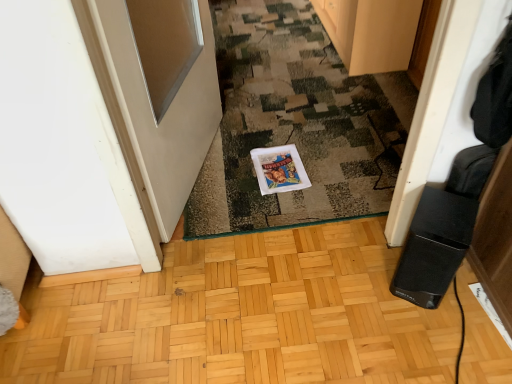
Question: Is camouflage carpet at center at the back of white glossy door at left?

Choices:
 (A) yes
 (B) no

Answer: (B)

Question: From a real-world perspective, does white glossy door at left stand above camouflage carpet at center?

Choices:
 (A) no
 (B) yes

Answer: (B)

Question: Does white glossy door at left have a greater height compared to camouflage carpet at center?

Choices:
 (A) yes
 (B) no

Answer: (A)

Question: Can you confirm if white glossy door at left is smaller than camouflage carpet at center?

Choices:
 (A) no
 (B) yes

Answer: (B)

Question: Can you confirm if white glossy door at left is shorter than camouflage carpet at center?

Choices:
 (A) no
 (B) yes

Answer: (A)

Question: Considering the relative sizes of white glossy door at left and camouflage carpet at center in the image provided, is white glossy door at left bigger than camouflage carpet at center?

Choices:
 (A) yes
 (B) no

Answer: (B)

Question: Considering the relative sizes of camouflage carpet at center and wooden cabinet at upper center in the image provided, is camouflage carpet at center smaller than wooden cabinet at upper center?

Choices:
 (A) no
 (B) yes

Answer: (A)

Question: Is camouflage carpet at center not inside wooden cabinet at upper center?

Choices:
 (A) yes
 (B) no

Answer: (A)

Question: Considering the relative positions of camouflage carpet at center and wooden cabinet at upper center in the image provided, is camouflage carpet at center to the right of wooden cabinet at upper center from the viewer's perspective?

Choices:
 (A) yes
 (B) no

Answer: (B)

Question: Is camouflage carpet at center bigger than wooden cabinet at upper center?

Choices:
 (A) no
 (B) yes

Answer: (B)

Question: Is camouflage carpet at center facing away from wooden cabinet at upper center?

Choices:
 (A) yes
 (B) no

Answer: (B)

Question: Can you confirm if camouflage carpet at center is thinner than wooden cabinet at upper center?

Choices:
 (A) yes
 (B) no

Answer: (B)

Question: Does wooden cabinet at upper center have a greater height compared to camouflage carpet at center?

Choices:
 (A) yes
 (B) no

Answer: (A)